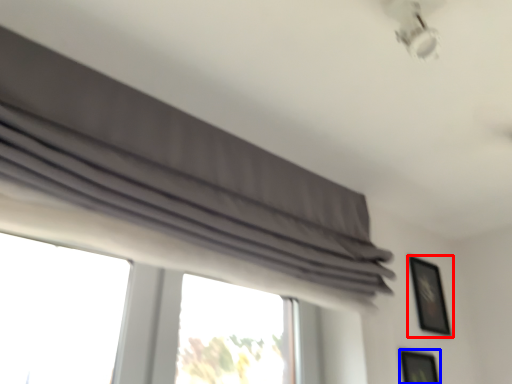
Question: Among these objects, which one is nearest to the camera, picture frame (highlighted by a red box) or picture frame (highlighted by a blue box)?

Choices:
 (A) picture frame
 (B) picture frame

Answer: (B)